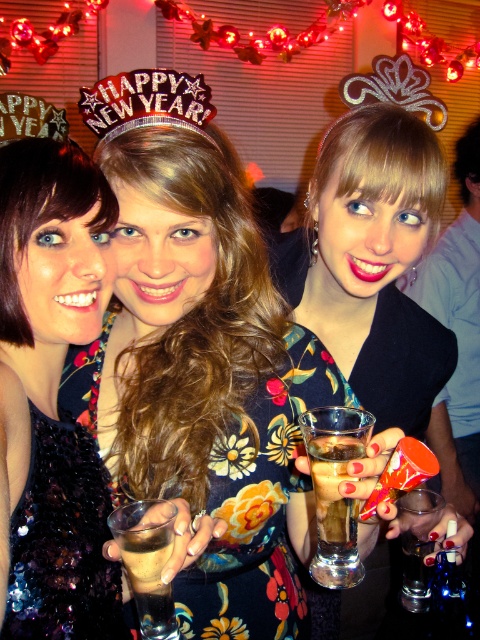
Question: Estimate the real-world distances between objects in this image. Which object is farther from the translucent glass drink at center?

Choices:
 (A) sequined dark blue dress at lower left
 (B) shiny sequin dress at center
 (C) matte black dress at center
 (D) sequined dress at left

Answer: (C)

Question: Is sequined dress at left to the right of matte black dress at center from the viewer's perspective?

Choices:
 (A) yes
 (B) no

Answer: (B)

Question: Is shiny sequin dress at center wider than sequined dress at left?

Choices:
 (A) no
 (B) yes

Answer: (B)

Question: Does translucent glass at center have a smaller size compared to glittery gold crown at upper center?

Choices:
 (A) no
 (B) yes

Answer: (B)

Question: Which object appears farthest from the camera in this image?

Choices:
 (A) pink glittery tiara at center
 (B) shiny sequin dress at center
 (C) sequined dress at left

Answer: (B)

Question: Estimate the real-world distances between objects in this image. Which object is farther from the translucent glass at center?

Choices:
 (A) sequined dark blue dress at lower left
 (B) pink glittery tiara at center
 (C) matte black dress at center

Answer: (C)